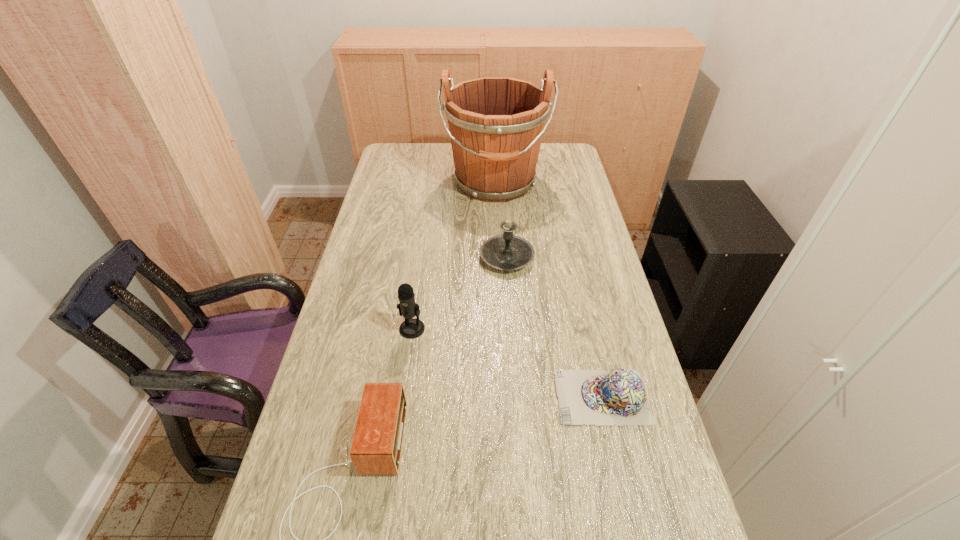
Find the location of a particular element. The width and height of the screenshot is (960, 540). bucket is located at coordinates (496, 124).

At what (x,y) coordinates should I click in order to perform the action: click on the farthest object. Please return your answer as a coordinate pair (x, y). Image resolution: width=960 pixels, height=540 pixels. Looking at the image, I should click on (496, 124).

What are the coordinates of `microphone` in the screenshot? It's located at (411, 328).

What are the coordinates of `candle` in the screenshot? It's located at (505, 252).

At what (x,y) coordinates should I click in order to perform the action: click on cap. Please return your answer as a coordinate pair (x, y). Looking at the image, I should click on (592, 397).

Where is `free space located 0.070m with the handle on the side of the bucket`? free space located 0.070m with the handle on the side of the bucket is located at coordinates (496, 226).

Image resolution: width=960 pixels, height=540 pixels. I want to click on vacant space located on the right of the microphone, so click(x=468, y=328).

Where is `vacant space located 0.130m on the right of the fourth nearest object`? vacant space located 0.130m on the right of the fourth nearest object is located at coordinates (573, 258).

Where is `vacant region located on the front, side, and top of the shortest object`? This screenshot has height=540, width=960. vacant region located on the front, side, and top of the shortest object is located at coordinates (484, 397).

Locate an element on the screen. Image resolution: width=960 pixels, height=540 pixels. vacant space located on the front, side, and top of the shortest object is located at coordinates (460, 397).